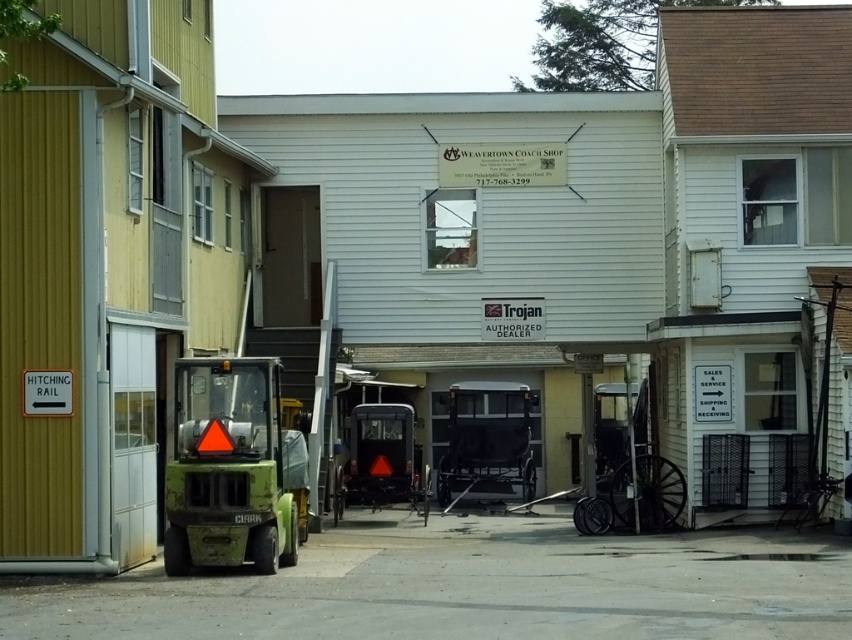
Which is above, metallic polished buggy at center or amber wood cart at center?

metallic polished buggy at center is above.

Consider the image. Is metallic polished buggy at center positioned in front of amber wood cart at center?

No.

Does point (517, 406) come closer to viewer compared to point (352, 476)?

No, it is not.

Locate an element on the screen. The height and width of the screenshot is (640, 852). metallic polished buggy at center is located at coordinates (486, 440).

Does metallic polished buggy at center appear under wooden cart at center?

Yes, metallic polished buggy at center is below wooden cart at center.

Does metallic polished buggy at center come behind wooden cart at center?

Yes.

Is point (499, 384) in front of point (588, 525)?

No, (499, 384) is further to viewer.

The height and width of the screenshot is (640, 852). I want to click on metallic polished buggy at center, so click(486, 440).

Is amber wood cart at center positioned in front of wooden cart at center?

No, it is behind wooden cart at center.

This screenshot has width=852, height=640. What do you see at coordinates (380, 460) in the screenshot?
I see `amber wood cart at center` at bounding box center [380, 460].

This screenshot has height=640, width=852. Identify the location of amber wood cart at center. (380, 460).